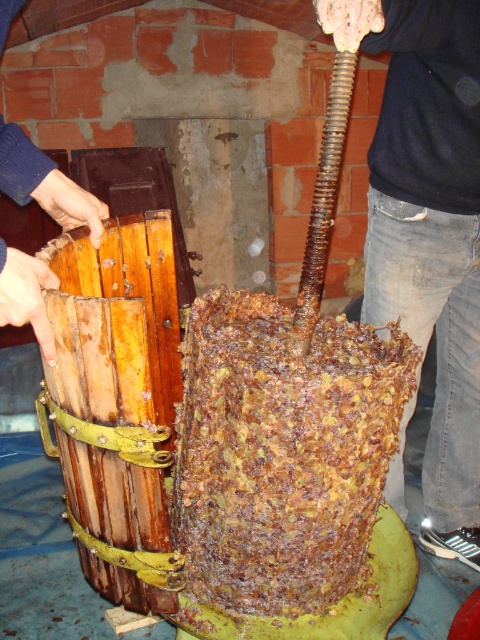
Is jeans at center bigger than wooden crate at left?

Yes, jeans at center is bigger than wooden crate at left.

Does jeans at center appear under wooden crate at left?

Yes, jeans at center is below wooden crate at left.

Who is more distant from viewer, (377,182) or (36,330)?

Point (377,182)

You are a GUI agent. You are given a task and a screenshot of the screen. Output one action in this format:
    pyautogui.click(x=<x>, y=<y>)
    Task: Click on the jeans at center
    This screenshot has height=640, width=480.
    Given the screenshot: What is the action you would take?
    pyautogui.click(x=428, y=228)

Does rusty metallic barrel at center appear over wooden crate at left?

Actually, rusty metallic barrel at center is below wooden crate at left.

Does point (309, 570) lie in front of point (49, 179)?

No, it is behind (49, 179).

At what (x,y) coordinates should I click in order to perform the action: click on rusty metallic barrel at center. Please return your answer as a coordinate pair (x, y). Looking at the image, I should click on (282, 452).

Does rusty metallic barrel at center come in front of jeans at center?

That is False.

Between point (263, 538) and point (396, 76), which one is positioned in front?

Positioned in front is point (263, 538).

I want to click on rusty metallic barrel at center, so click(282, 452).